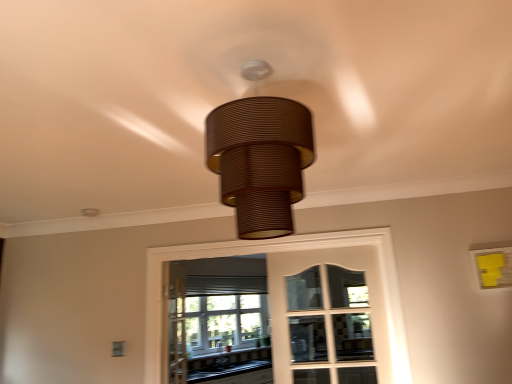
Measure the distance between white glass screen door at center and camera.

The distance of white glass screen door at center from camera is 2.62 meters.

Describe the element at coordinates (234, 373) in the screenshot. This screenshot has height=384, width=512. I see `black laminate countertop at lower center` at that location.

What do you see at coordinates (260, 161) in the screenshot? I see `brown textured lampshade at center` at bounding box center [260, 161].

Image resolution: width=512 pixels, height=384 pixels. What do you see at coordinates (225, 323) in the screenshot?
I see `matte glass bay window at center` at bounding box center [225, 323].

Find the location of a particular element. The height and width of the screenshot is (384, 512). white glass screen door at center is located at coordinates (327, 315).

Looking at the image, does white glass screen door at center seem bigger or smaller compared to brown textured lampshade at center?

In the image, white glass screen door at center appears to be larger than brown textured lampshade at center.

Is point (285, 306) positioned after point (266, 156)?

Yes, it is behind point (266, 156).

In the scene shown: Is white glass screen door at center next to brown textured lampshade at center and touching it?

white glass screen door at center is not next to brown textured lampshade at center, and they're not touching.

Can you tell me how much white glass screen door at center and brown textured lampshade at center differ in facing direction?

179 degrees.

Is matte glass bay window at center located outside black laminate countertop at lower center?

Yes, matte glass bay window at center is located beyond the bounds of black laminate countertop at lower center.

From the image's perspective, is matte glass bay window at center under black laminate countertop at lower center?

Actually, matte glass bay window at center appears above black laminate countertop at lower center in the image.

Does matte glass bay window at center touch black laminate countertop at lower center?

No, matte glass bay window at center is not making contact with black laminate countertop at lower center.

From a real-world perspective, is brown textured lampshade at center over matte glass bay window at center?

Yes, from a real-world perspective, brown textured lampshade at center is on top of matte glass bay window at center.

Can you tell me how much brown textured lampshade at center and matte glass bay window at center differ in facing direction?

125 degrees separate the facing orientations of brown textured lampshade at center and matte glass bay window at center.

Which object is thinner, brown textured lampshade at center or matte glass bay window at center?

matte glass bay window at center.

Identify the location of bay window on the left side of brown textured lampshade at center. This screenshot has width=512, height=384. tap(225, 323).

Identify the location of counter top behind the clear glass window at center. (234, 373).

Which of these two, clear glass window at center or black laminate countertop at lower center, is thinner?

clear glass window at center is thinner.

Between clear glass window at center and black laminate countertop at lower center, which one appears on the right side from the viewer's perspective?

Positioned to the right is clear glass window at center.

Is clear glass window at center oriented towards brown textured lampshade at center?

Yes, clear glass window at center faces towards brown textured lampshade at center.

Based on their sizes in the image, would you say clear glass window at center is bigger or smaller than brown textured lampshade at center?

Clearly, clear glass window at center is larger in size than brown textured lampshade at center.

From a real-world perspective, which object stands above the other?

brown textured lampshade at center is physically above.

What's the angular difference between clear glass window at center and brown textured lampshade at center's facing directions?

The facing directions of clear glass window at center and brown textured lampshade at center are 179 degrees apart.

Looking at this image, which of these two, brown textured lampshade at center or black laminate countertop at lower center, is smaller?

With smaller size is brown textured lampshade at center.

Is black laminate countertop at lower center a part of brown textured lampshade at center?

No, black laminate countertop at lower center is not inside brown textured lampshade at center.

Could you tell me if brown textured lampshade at center is facing black laminate countertop at lower center?

Yes.

Can you confirm if brown textured lampshade at center is shorter than clear glass window at center?

Yes.

From a real-world perspective, which object rests below the other?

clear glass window at center.

From the image's perspective, is brown textured lampshade at center below clear glass window at center?

No.

Considering the positions of points (228, 186) and (391, 347), is point (228, 186) farther from camera compared to point (391, 347)?

That is False.

Identify the location of screen door behind the brown textured lampshade at center. This screenshot has width=512, height=384. (327, 315).

At what (x,y) coordinates should I click in order to perform the action: click on bay window on the right of black laminate countertop at lower center. Please return your answer as a coordinate pair (x, y). The image size is (512, 384). Looking at the image, I should click on (225, 323).

Considering their positions, is matte glass bay window at center positioned closer to black laminate countertop at lower center than brown textured lampshade at center?

matte glass bay window at center is positioned closer to the anchor black laminate countertop at lower center.

Looking at the image, which one is located closer to black laminate countertop at lower center, clear glass window at center or matte glass bay window at center?

The object closer to black laminate countertop at lower center is matte glass bay window at center.

Estimate the real-world distances between objects in this image. Which object is closer to black laminate countertop at lower center, brown textured lampshade at center or white glass screen door at center?

Based on the image, white glass screen door at center appears to be nearer to black laminate countertop at lower center.

In the scene shown: When comparing their distances from brown textured lampshade at center, does black laminate countertop at lower center or matte glass bay window at center seem further?

The object further to brown textured lampshade at center is black laminate countertop at lower center.

Estimate the real-world distances between objects in this image. Which object is closer to black laminate countertop at lower center, clear glass window at center or white glass screen door at center?

The object closer to black laminate countertop at lower center is white glass screen door at center.

When comparing their distances from matte glass bay window at center, does black laminate countertop at lower center or white glass screen door at center seem closer?

Among the two, black laminate countertop at lower center is located nearer to matte glass bay window at center.

Considering their positions, is brown textured lampshade at center positioned closer to white glass screen door at center than clear glass window at center?

The object closer to white glass screen door at center is clear glass window at center.

When comparing their distances from matte glass bay window at center, does clear glass window at center or black laminate countertop at lower center seem closer?

black laminate countertop at lower center is closer to matte glass bay window at center.

Identify the location of screen door positioned between clear glass window at center and matte glass bay window at center from near to far. (327, 315).

You are a GUI agent. You are given a task and a screenshot of the screen. Output one action in this format:
    pyautogui.click(x=<x>, y=<y>)
    Task: Click on the window between brown textured lampshade at center and black laminate countertop at lower center from front to back
    
    Given the screenshot: What is the action you would take?
    pyautogui.click(x=276, y=252)

At what (x,y) coordinates should I click in order to perform the action: click on screen door located between brown textured lampshade at center and matte glass bay window at center in the depth direction. Please return your answer as a coordinate pair (x, y). The height and width of the screenshot is (384, 512). Looking at the image, I should click on (327, 315).

Locate an element on the screen. Image resolution: width=512 pixels, height=384 pixels. screen door between clear glass window at center and black laminate countertop at lower center in the front-back direction is located at coordinates pyautogui.click(x=327, y=315).